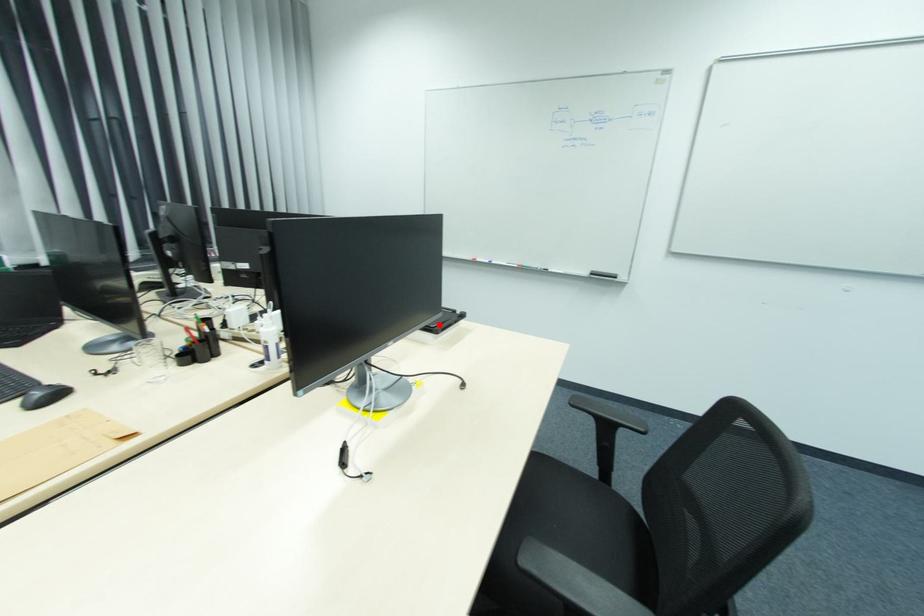
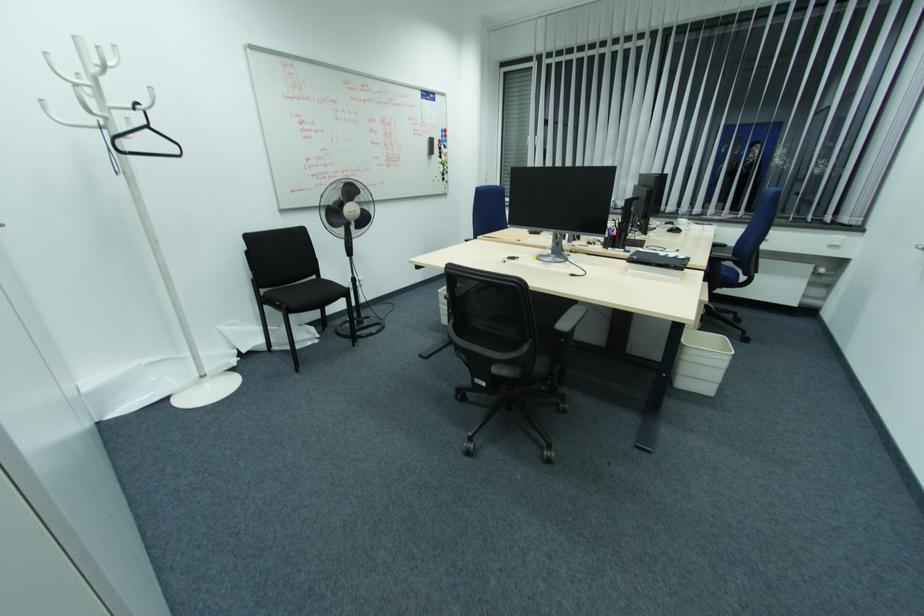
The point at the highlighted location is marked in the first image. Where is the corresponding point in the second image?

(638, 257)